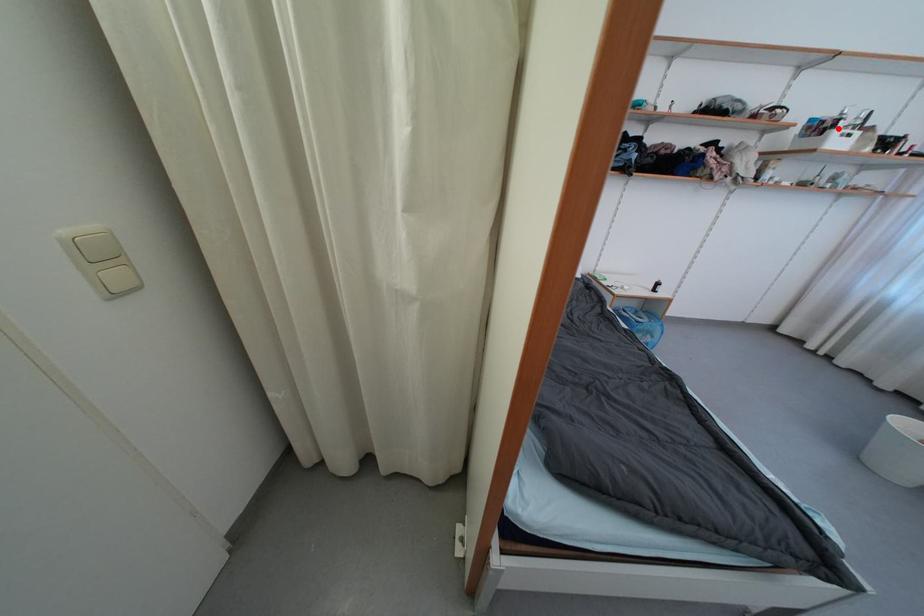
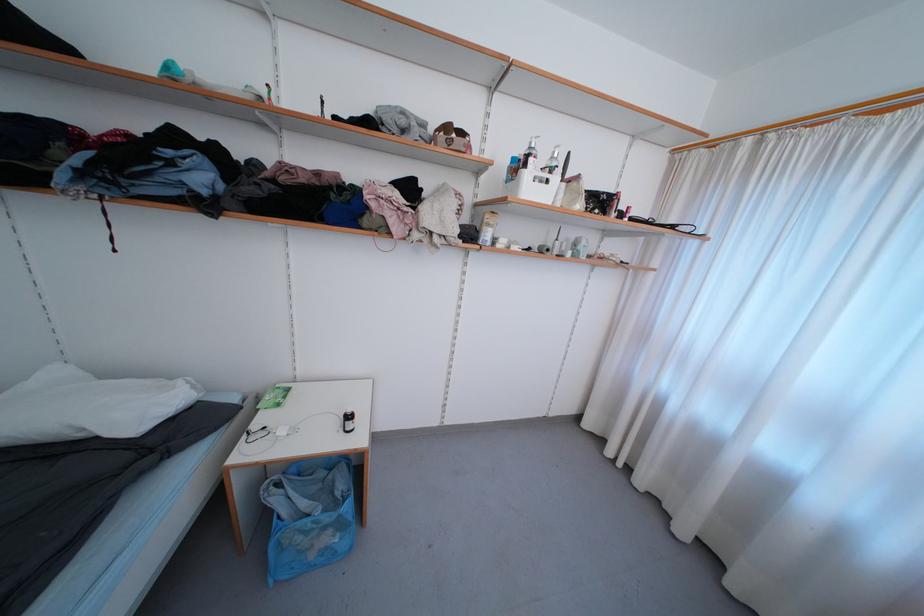
Question: I am providing you with two images of the same scene from different viewpoints. Image1 has a red point marked. In image2, the corresponding 3D location appears at what relative position? Reply with the corresponding letter.

Choices:
 (A) Closer
 (B) Farther

Answer: (A)